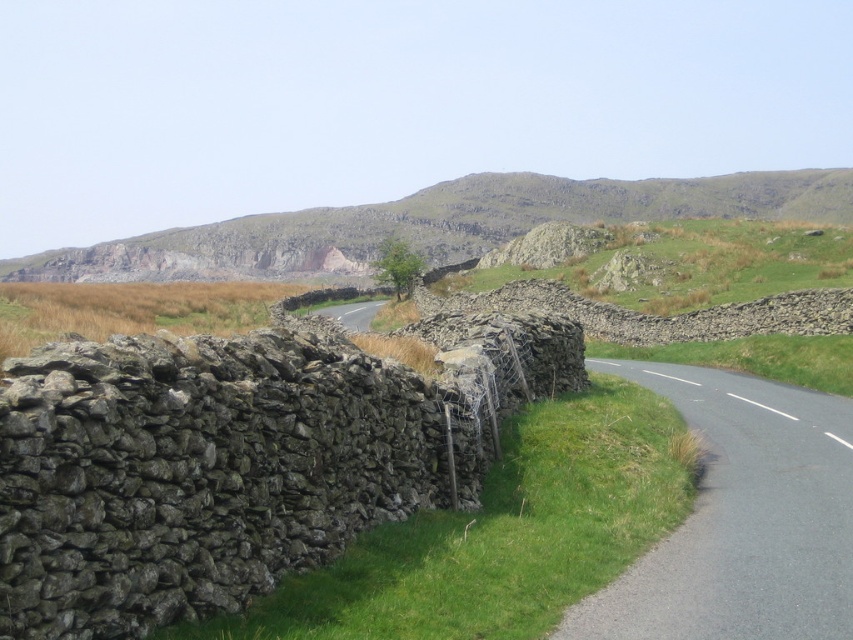
Is gray asphalt road at center-right taller than rugged stone hillside at upper center?

No.

The width and height of the screenshot is (853, 640). Describe the element at coordinates (741, 518) in the screenshot. I see `gray asphalt road at center-right` at that location.

At what (x,y) coordinates should I click in order to perform the action: click on gray asphalt road at center-right. Please return your answer as a coordinate pair (x, y). Image resolution: width=853 pixels, height=640 pixels. Looking at the image, I should click on (741, 518).